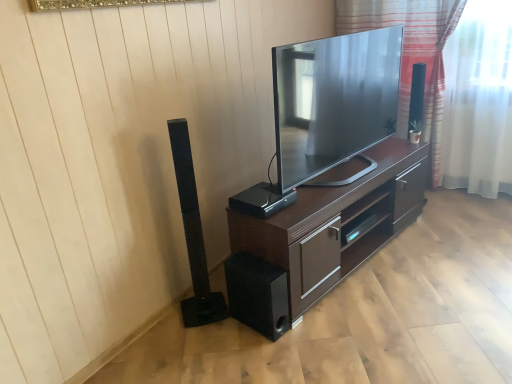
This screenshot has width=512, height=384. What are the coordinates of `free space underneath matte black tv at center (from a real-world perspective)` in the screenshot? It's located at click(x=348, y=172).